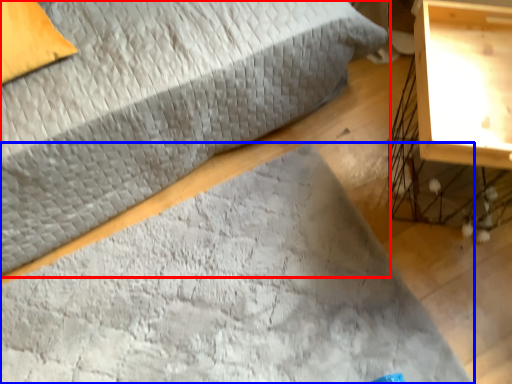
Question: Among these objects, which one is nearest to the camera, bed (highlighted by a red box) or mat (highlighted by a blue box)?

Choices:
 (A) bed
 (B) mat

Answer: (A)